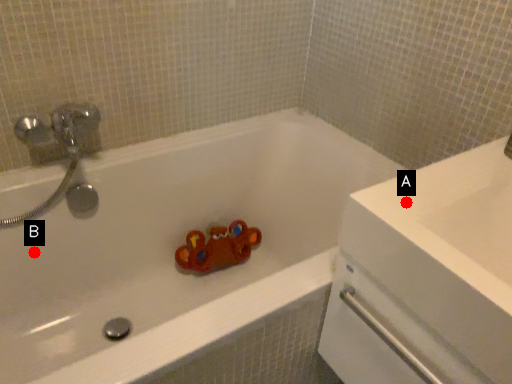
Question: Two points are circled on the image, labeled by A and B beside each circle. Which of the following is the farthest from the observer?

Choices:
 (A) A is further
 (B) B is further

Answer: (B)